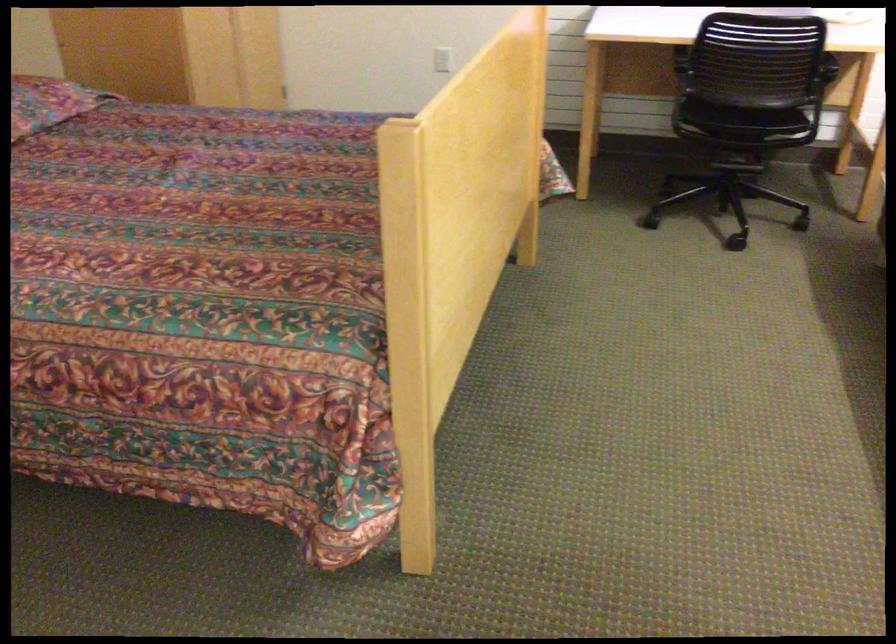
The height and width of the screenshot is (644, 896). I want to click on white light switch, so click(x=444, y=60).